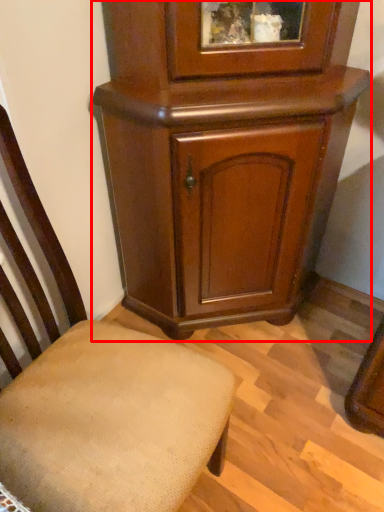
Question: In this image, where is cupboard (annotated by the red box) located relative to chair?

Choices:
 (A) right
 (B) left

Answer: (A)